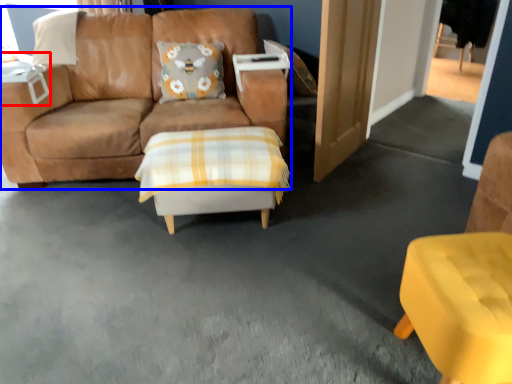
Question: Which of the following is the closest to the observer, table (highlighted by a red box) or studio couch (highlighted by a blue box)?

Choices:
 (A) table
 (B) studio couch

Answer: (B)